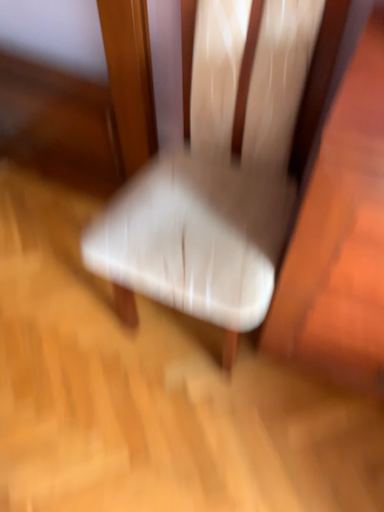
This screenshot has width=384, height=512. Find the location of `vacant space in front of white fabric chair at center`. vacant space in front of white fabric chair at center is located at coordinates (162, 461).